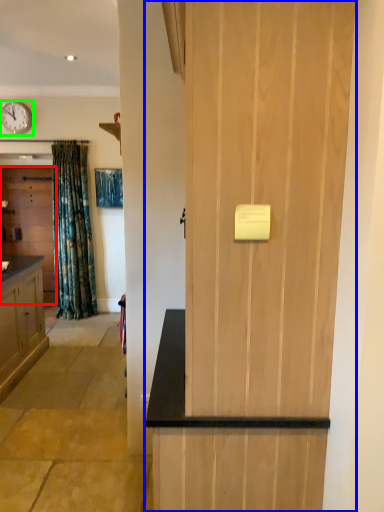
Question: Considering the real-world distances, which object is farthest from door (highlighted by a red box)? door (highlighted by a blue box) or clock (highlighted by a green box)?

Choices:
 (A) door
 (B) clock

Answer: (A)